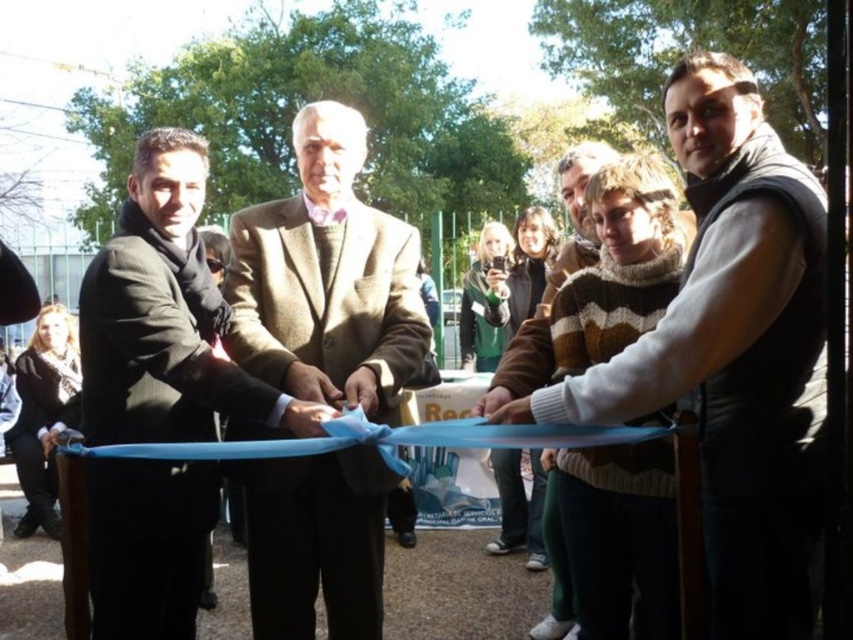
Who is more forward, [369,524] or [132,538]?

Point [132,538] is in front.

Which of these two, brown woolen coat at center or matte black suit at center, stands shorter?

matte black suit at center is shorter.

Find the location of `brown woolen coat at center`. brown woolen coat at center is located at coordinates (328, 280).

I want to click on brown woolen coat at center, so 328,280.

Can you confirm if velvet brown vest at right is positioned to the right of matte black suit at center?

Correct, you'll find velvet brown vest at right to the right of matte black suit at center.

Is point (529, 412) positioned behind point (119, 227)?

No, (529, 412) is closer to viewer.

In order to click on velvet brown vest at right in this screenshot , I will do `click(735, 353)`.

Who is taller, velvet brown vest at right or brown woolen coat at center?

brown woolen coat at center is taller.

What do you see at coordinates (735, 353) in the screenshot?
I see `velvet brown vest at right` at bounding box center [735, 353].

Locate an element on the screen. The image size is (853, 640). velvet brown vest at right is located at coordinates (735, 353).